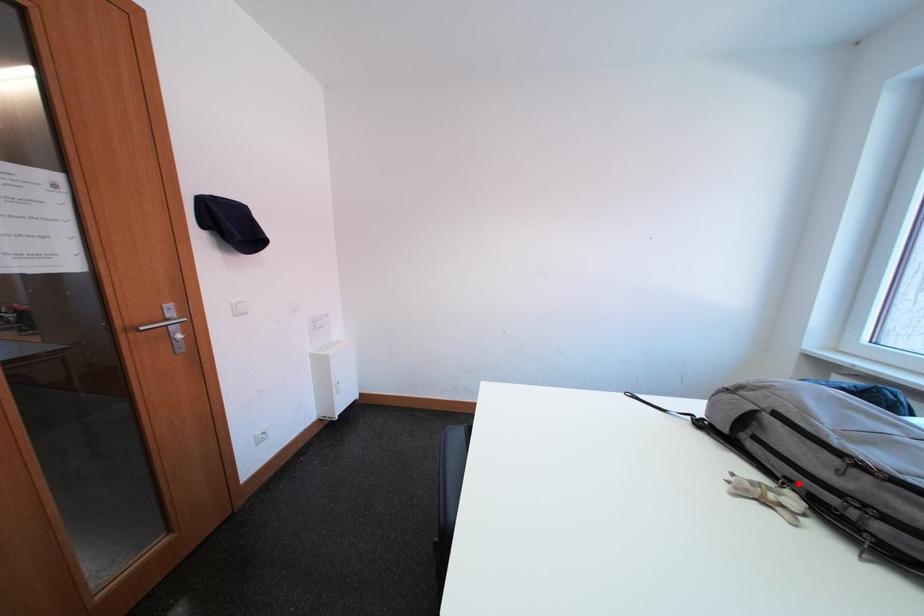
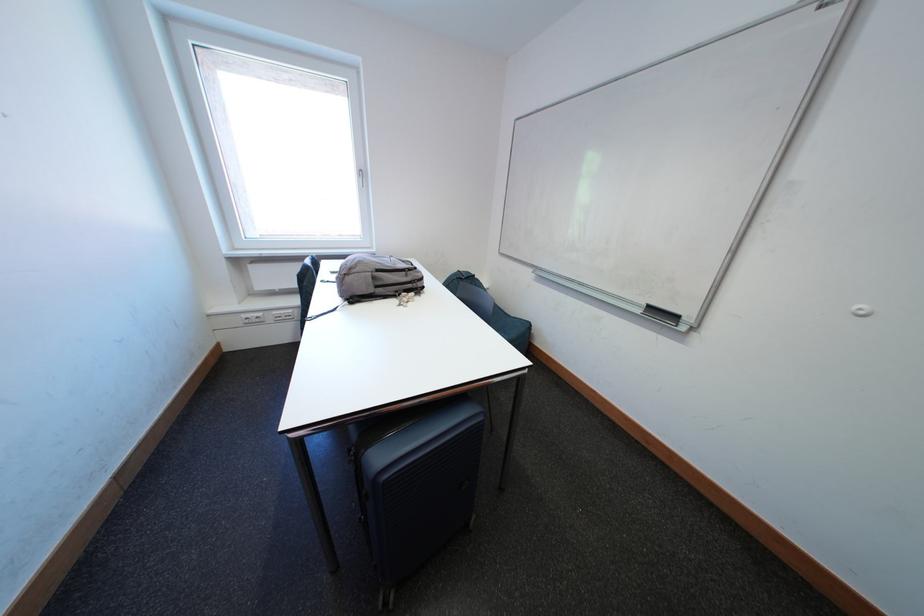
Find the pixel in the second image that matches the highlighted location in the first image.

(406, 294)